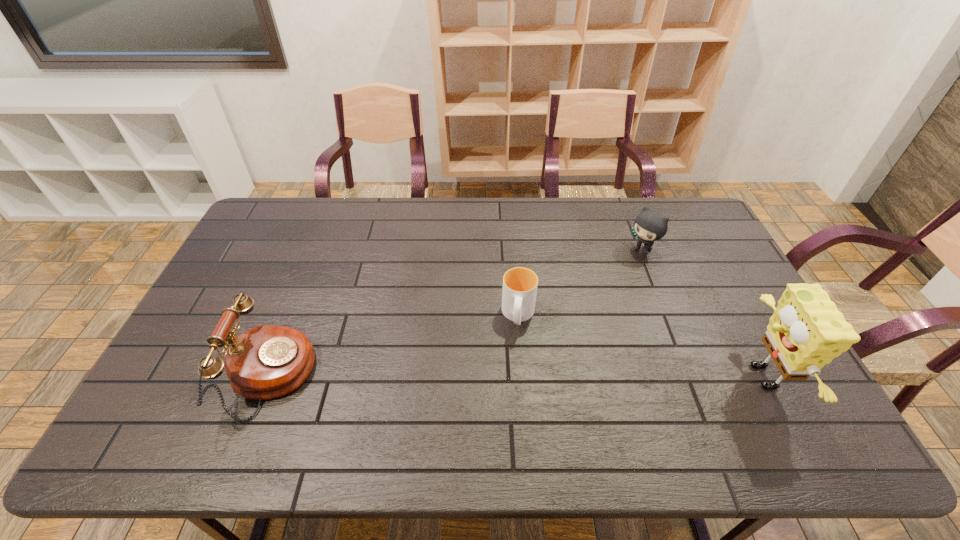
This screenshot has height=540, width=960. Find the location of `object located at the right edge`. object located at the right edge is located at coordinates (806, 331).

This screenshot has width=960, height=540. What are the coordinates of `object at the near right corner` in the screenshot? It's located at (806, 331).

At what (x,y) coordinates should I click in order to perform the action: click on free region at the far edge of the desktop. Please return your answer as a coordinate pair (x, y). Looking at the image, I should click on (615, 226).

The height and width of the screenshot is (540, 960). I want to click on free region at the near edge of the desktop, so click(x=605, y=383).

Locate an element on the screen. This screenshot has height=540, width=960. vacant region at the left edge of the desktop is located at coordinates (254, 245).

In the image, there is a desktop. At what (x,y) coordinates should I click in order to perform the action: click on free space at the right edge. Please return your answer as a coordinate pair (x, y). The image size is (960, 540). Looking at the image, I should click on (694, 270).

In the image, there is a desktop. In order to click on free space at the far left corner in this screenshot , I will do `click(266, 207)`.

Locate an element on the screen. This screenshot has height=540, width=960. vacant point located between the farthest object and the rightmost object is located at coordinates (701, 314).

Where is `vacant area that lies between the tallest object and the third shortest object`? The height and width of the screenshot is (540, 960). vacant area that lies between the tallest object and the third shortest object is located at coordinates [516, 376].

Locate an element on the screen. The height and width of the screenshot is (540, 960). vacant point located between the kitten and the rightmost object is located at coordinates (701, 314).